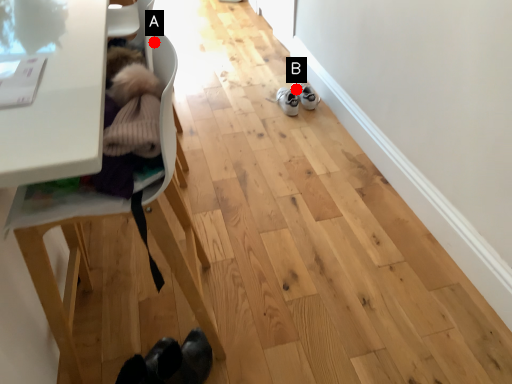
Question: Two points are circled on the image, labeled by A and B beside each circle. Which of the following is the farthest from the observer?

Choices:
 (A) A is further
 (B) B is further

Answer: (B)